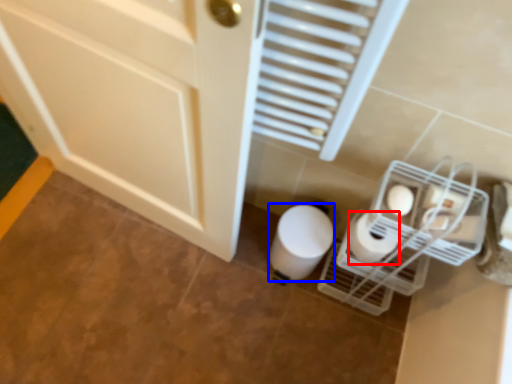
Question: Which object appears closest to the camera in this image, toilet paper (highlighted by a red box) or toilet paper (highlighted by a blue box)?

Choices:
 (A) toilet paper
 (B) toilet paper

Answer: (A)